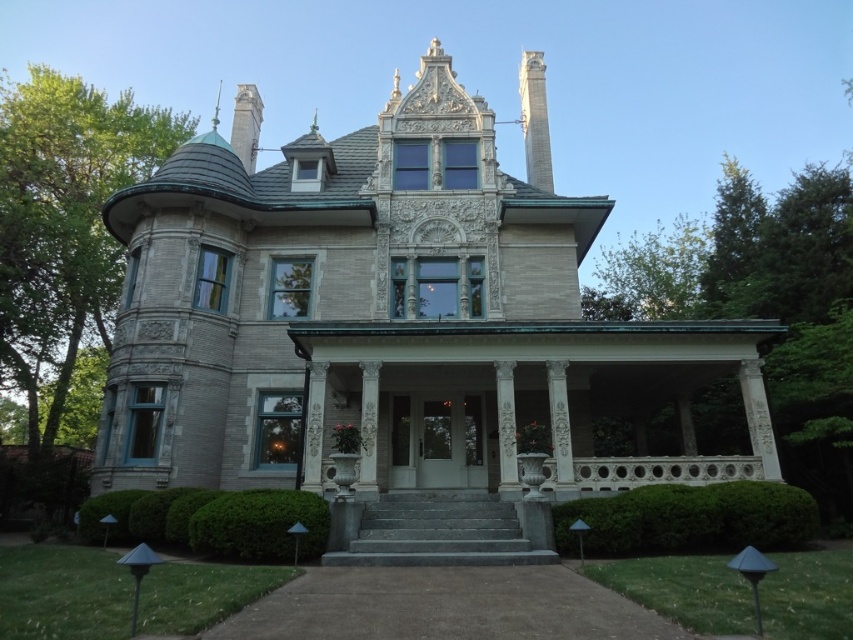
Is stone mansion at center smaller than green leafy hedge at lower center?

Incorrect, stone mansion at center is not smaller in size than green leafy hedge at lower center.

Between point (132, 307) and point (625, 513), which one is positioned behind?

The point (132, 307) is behind.

The width and height of the screenshot is (853, 640). Find the location of `stone mansion at center`. stone mansion at center is located at coordinates (389, 314).

Which is below, stone mansion at center or green leafy hedge at lower left?

green leafy hedge at lower left is lower down.

Can you confirm if stone mansion at center is positioned above green leafy hedge at lower left?

Correct, stone mansion at center is located above green leafy hedge at lower left.

Who is more forward, [343,148] or [242,531]?

Point [242,531] is in front.

Where is `stone mansion at center`? The height and width of the screenshot is (640, 853). stone mansion at center is located at coordinates (389, 314).

Between green leafy hedge at lower center and green leafy hedge at lower left, which one is positioned higher?

Positioned higher is green leafy hedge at lower center.

Is point (674, 522) more distant than point (219, 502)?

No, it is not.

Where is `green leafy hedge at lower center`? green leafy hedge at lower center is located at coordinates (688, 518).

Where is `green leafy hedge at lower center`? The height and width of the screenshot is (640, 853). green leafy hedge at lower center is located at coordinates (688, 518).